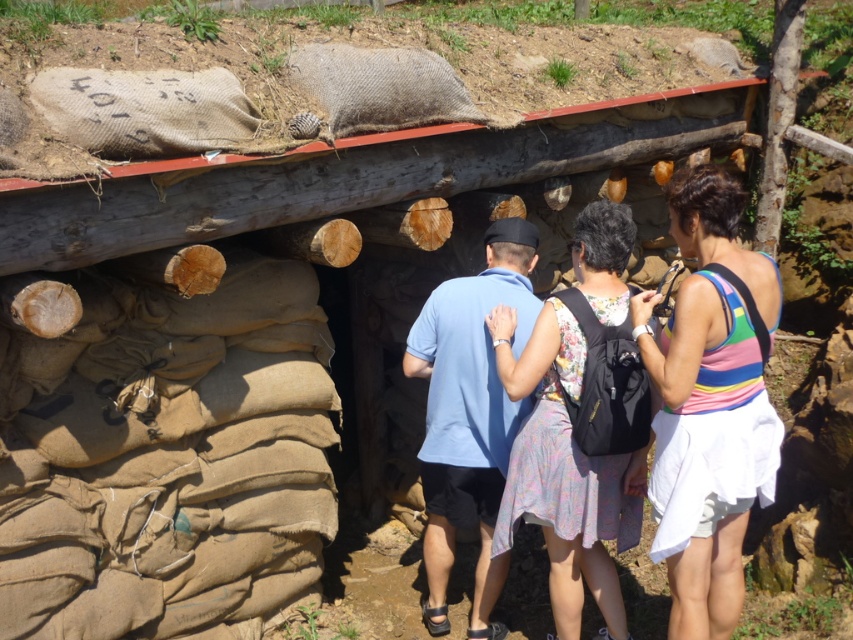
You are standing at the entrance of the rustic shelter and want to take a photo. There are two points marked in the image at coordinates point (569,636) and point (474,576). Which point should you focus on to ensure the subject is in the foreground?

Point (569,636) should be focused on because it is closer to the camera, making it part of the foreground.